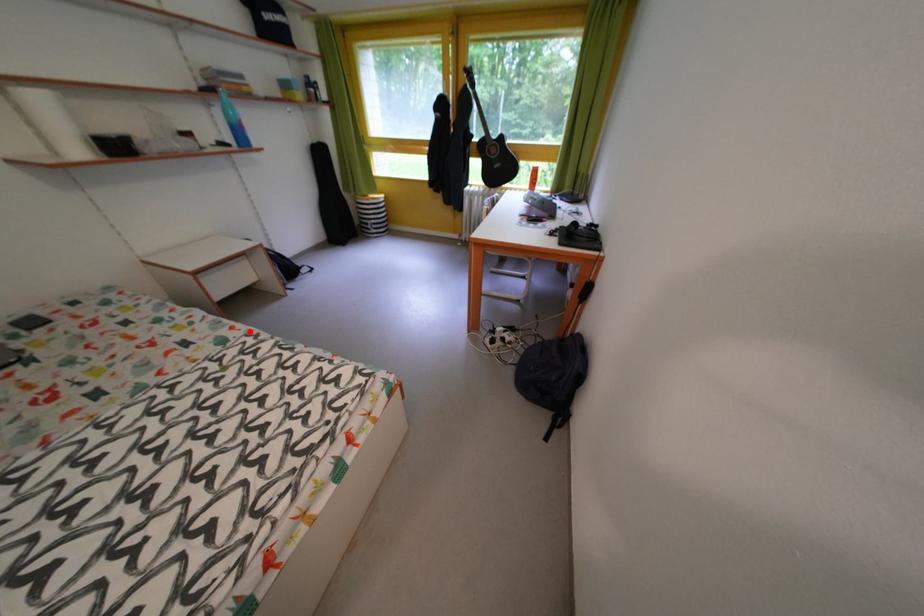
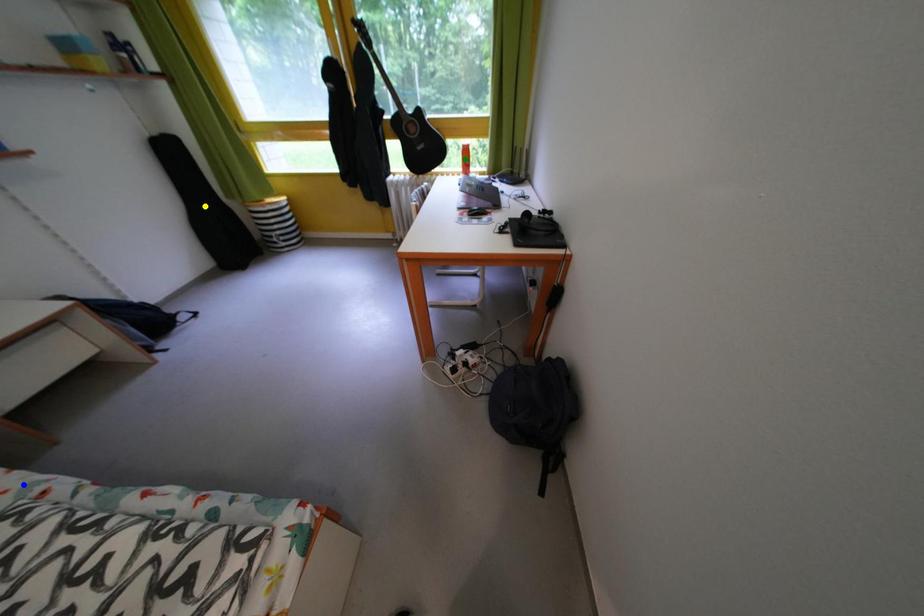
Question: I am providing you with two images of the same scene from different viewpoints. A red point is marked on the first image. You are given multiple points on the second image. Which point in image 2 is actually the same real-world point as the red point in image 1?

Choices:
 (A) blue point
 (B) green point
 (C) yellow point

Answer: (A)